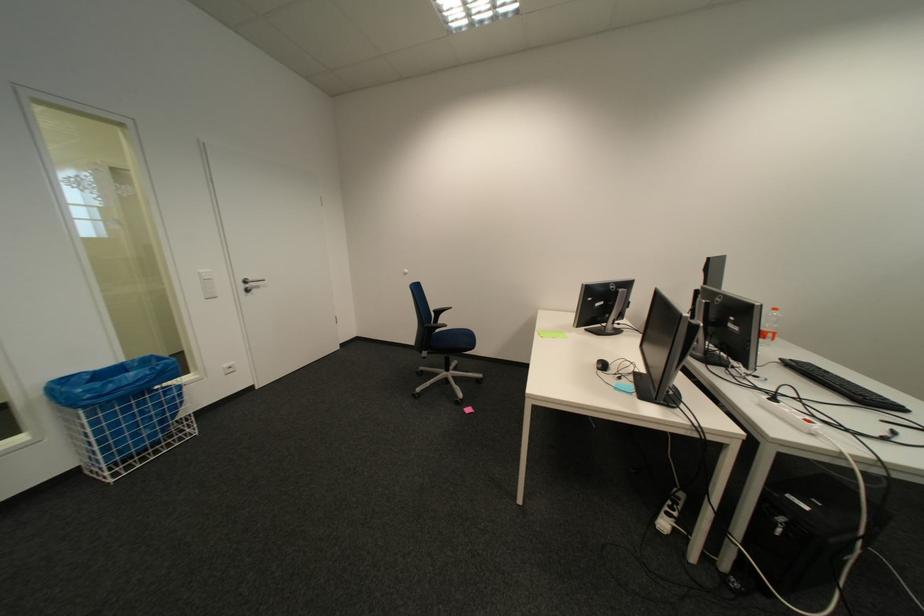
Describe the element at coordinates (769, 325) in the screenshot. I see `a clear plastic bottle` at that location.